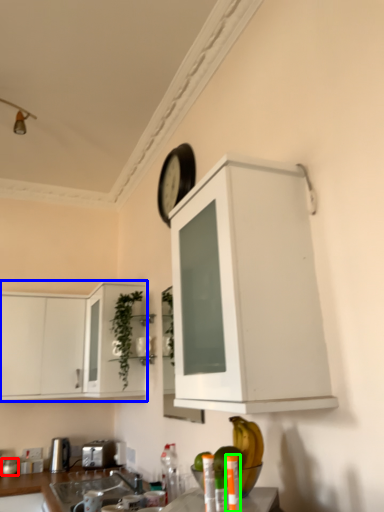
Question: Based on their relative distances, which object is nearer to appliance (highlighted by a red box)? Choose from cabinetry (highlighted by a blue box) and bottle (highlighted by a green box).

Choices:
 (A) cabinetry
 (B) bottle

Answer: (A)